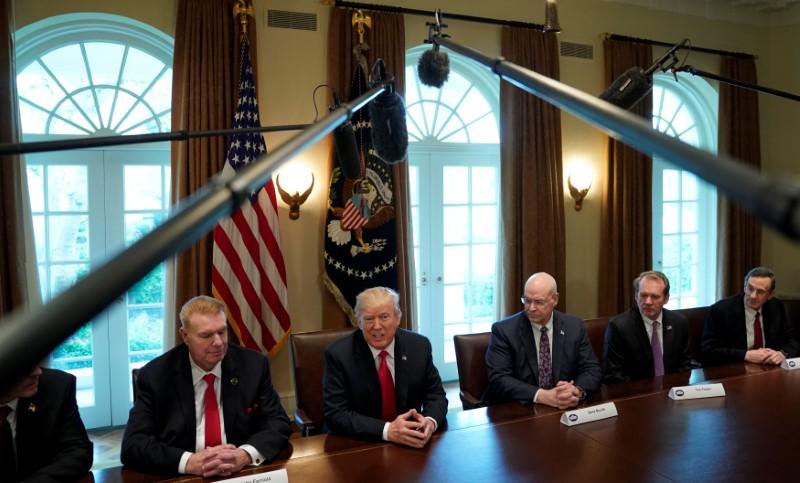
Identify the location of doors. (141, 187), (450, 179), (669, 183).